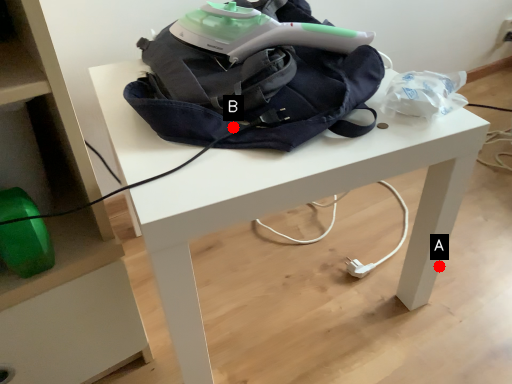
Question: Two points are circled on the image, labeled by A and B beside each circle. Which point is farther to the camera?

Choices:
 (A) A is further
 (B) B is further

Answer: (A)